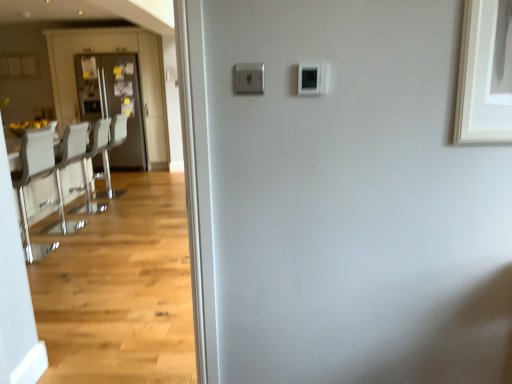
Question: In the image, is white leather armchair at left, which appears as the second armchair when viewed from the front, on the left side or the right side of matte black refrigerator at left?

Choices:
 (A) left
 (B) right

Answer: (B)

Question: Does point (114, 145) appear closer or farther from the camera than point (96, 49)?

Choices:
 (A) farther
 (B) closer

Answer: (A)

Question: Which of these objects is positioned farthest from the matte black refrigerator at left?

Choices:
 (A) matte gray door at left
 (B) white glossy armchair at left, placed as the 1th armchair when sorted from front to back
 (C) white glossy chair at left
 (D) white leather armchair at left, which appears as the second armchair when viewed from the front
 (E) white plastic thermostat at upper center

Answer: (E)

Question: Based on their relative distances, which object is nearer to the matte black refrigerator at left?

Choices:
 (A) white glossy armchair at left, placed as the 1th armchair when sorted from front to back
 (B) white leather chairs at left
 (C) white plastic thermostat at upper center
 (D) matte gray door at left
 (E) white glossy chair at left

Answer: (D)